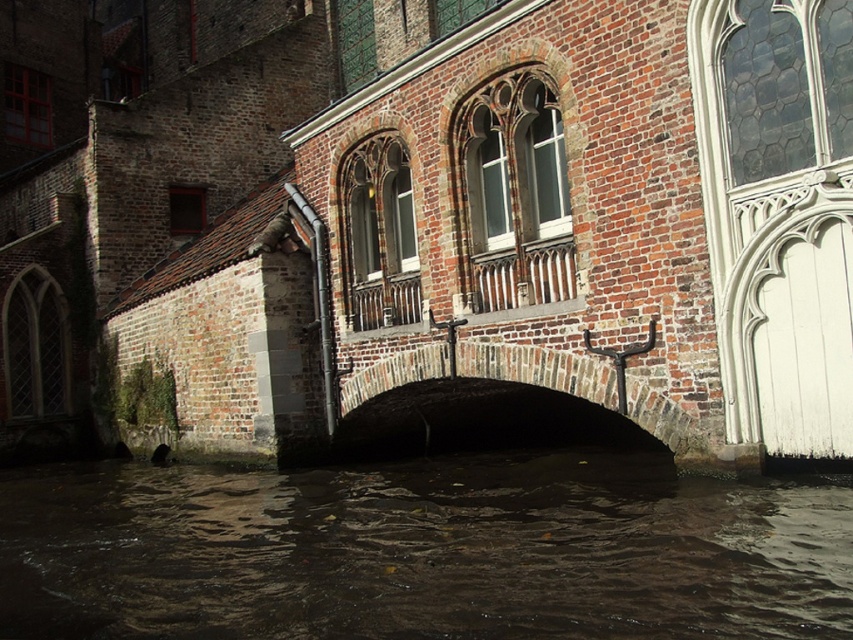
Is the position of brown murky water at center less distant than that of brick stone bridge at center?

Yes, brown murky water at center is closer to the viewer.

Is brown murky water at center smaller than brick stone bridge at center?

No, brown murky water at center is not smaller than brick stone bridge at center.

Which is in front, point (575, 481) or point (599, 396)?

Point (599, 396) is more forward.

You are a GUI agent. You are given a task and a screenshot of the screen. Output one action in this format:
    pyautogui.click(x=<x>, y=<y>)
    Task: Click on the brown murky water at center
    Image resolution: width=853 pixels, height=640 pixels.
    Given the screenshot: What is the action you would take?
    pyautogui.click(x=422, y=552)